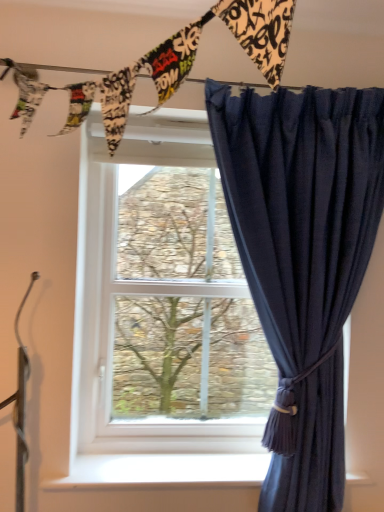
Question: From a real-world perspective, is navy blue sheer curtain at right beneath white plastic window at center?

Choices:
 (A) yes
 (B) no

Answer: (A)

Question: Is navy blue sheer curtain at right shorter than white plastic window at center?

Choices:
 (A) no
 (B) yes

Answer: (A)

Question: Is navy blue sheer curtain at right further to the viewer compared to white plastic window at center?

Choices:
 (A) yes
 (B) no

Answer: (B)

Question: Is navy blue sheer curtain at right turned away from white plastic window at center?

Choices:
 (A) no
 (B) yes

Answer: (B)

Question: Is navy blue sheer curtain at right outside white plastic window at center?

Choices:
 (A) no
 (B) yes

Answer: (B)

Question: From a real-world perspective, is navy blue sheer curtain at right over white plastic window at center?

Choices:
 (A) yes
 (B) no

Answer: (B)

Question: Does navy blue sheer curtain at right appear on the left side of white smooth window sill at lower center?

Choices:
 (A) yes
 (B) no

Answer: (B)

Question: Is the depth of navy blue sheer curtain at right greater than that of white smooth window sill at lower center?

Choices:
 (A) yes
 (B) no

Answer: (B)

Question: Considering the relative sizes of navy blue sheer curtain at right and white smooth window sill at lower center in the image provided, is navy blue sheer curtain at right shorter than white smooth window sill at lower center?

Choices:
 (A) yes
 (B) no

Answer: (B)

Question: Is navy blue sheer curtain at right at the right side of white smooth window sill at lower center?

Choices:
 (A) no
 (B) yes

Answer: (B)

Question: Is white smooth window sill at lower center surrounded by navy blue sheer curtain at right?

Choices:
 (A) no
 (B) yes

Answer: (A)

Question: Considering the relative sizes of navy blue sheer curtain at right and white smooth window sill at lower center in the image provided, is navy blue sheer curtain at right wider than white smooth window sill at lower center?

Choices:
 (A) yes
 (B) no

Answer: (B)

Question: Is white smooth window sill at lower center further to the viewer compared to white plastic window at center?

Choices:
 (A) yes
 (B) no

Answer: (B)